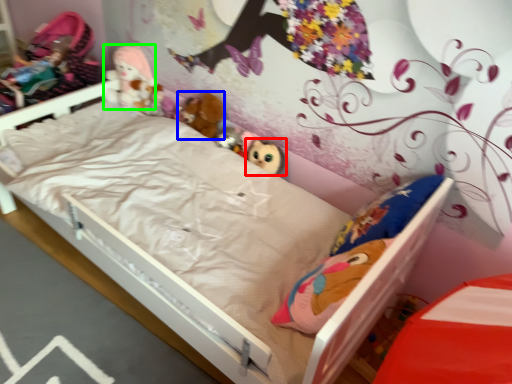
Question: Considering the real-world distances, which object is farthest from toy (highlighted by a red box)? doll (highlighted by a blue box) or doll (highlighted by a green box)?

Choices:
 (A) doll
 (B) doll

Answer: (B)